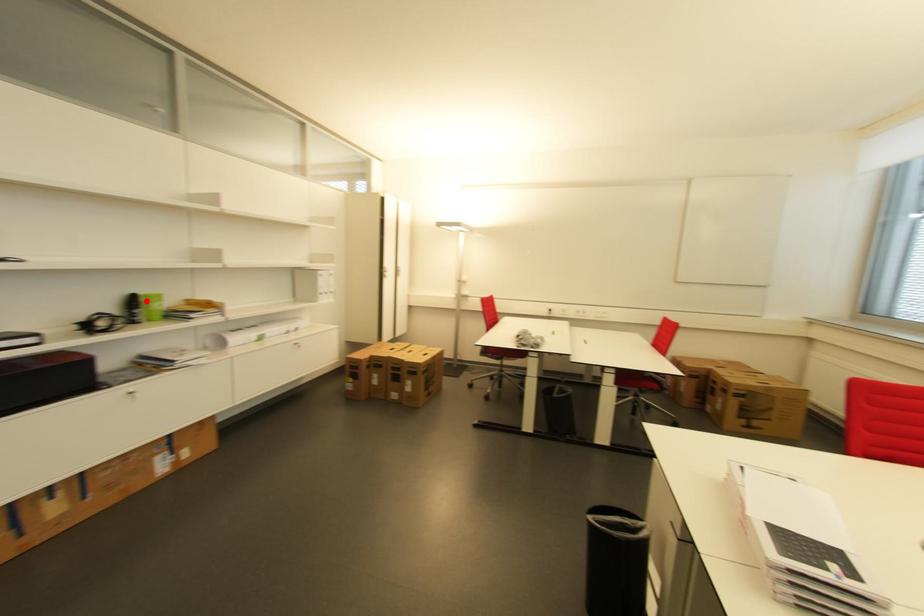
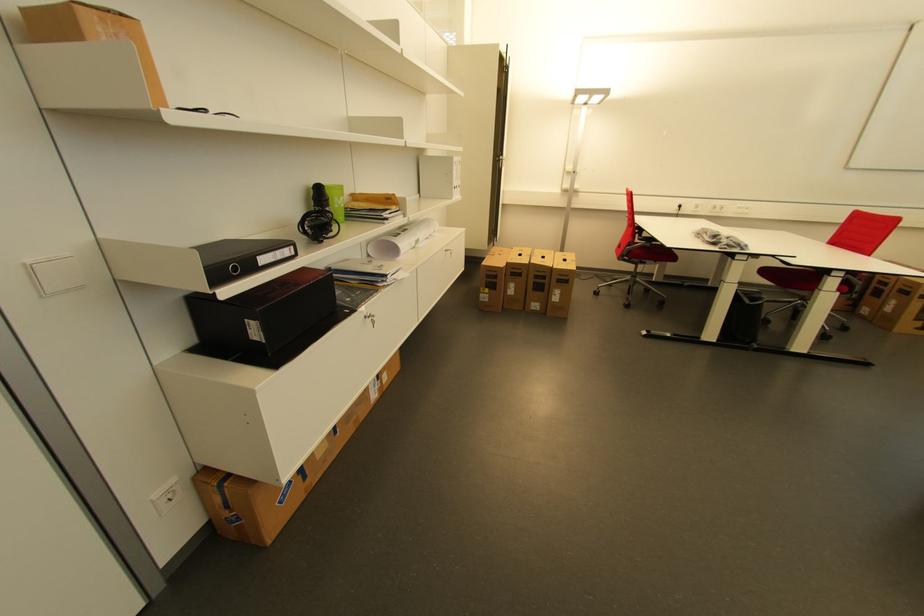
In the second image, find the point that corresponds to the highlighted location in the first image.

(333, 193)